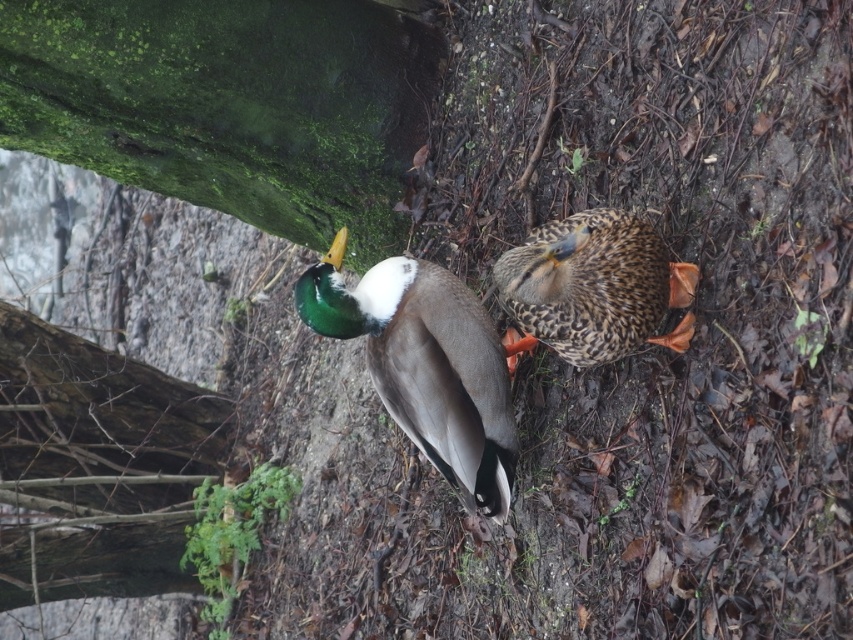
Which of these two, green mossy tree trunk at upper left or green glossy duck at center, stands shorter?

With less height is green glossy duck at center.

Who is more distant from viewer, (x=368, y=218) or (x=492, y=372)?

Point (x=368, y=218)

The width and height of the screenshot is (853, 640). What are the coordinates of `green mossy tree trunk at upper left` in the screenshot? It's located at (229, 104).

Between green glossy duck at center and speckled feathered duck at center, which one appears on the left side from the viewer's perspective?

From the viewer's perspective, green glossy duck at center appears more on the left side.

Who is positioned more to the right, green glossy duck at center or speckled feathered duck at center?

speckled feathered duck at center

Which is in front, point (357, 330) or point (645, 248)?

Point (645, 248) is more forward.

Where is `green glossy duck at center`? The width and height of the screenshot is (853, 640). green glossy duck at center is located at coordinates (426, 365).

Is point (65, 467) farther from camera compared to point (607, 220)?

That is True.

Locate an element on the screen. This screenshot has width=853, height=640. green mossy tree trunk at upper left is located at coordinates (229, 104).

Is point (91, 410) positioned behind point (592, 218)?

Yes, point (91, 410) is farther from viewer.

Where is `green mossy tree trunk at upper left`? green mossy tree trunk at upper left is located at coordinates (229, 104).